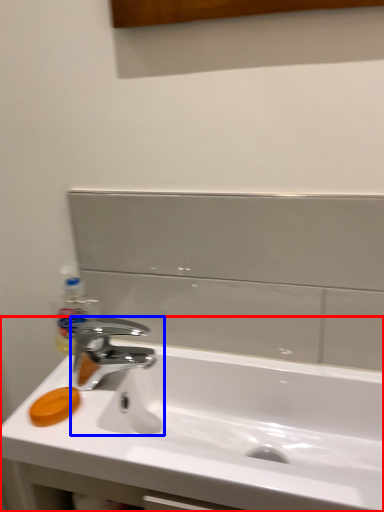
Question: Which point is further to the camera, sink (highlighted by a red box) or tap (highlighted by a blue box)?

Choices:
 (A) sink
 (B) tap

Answer: (B)